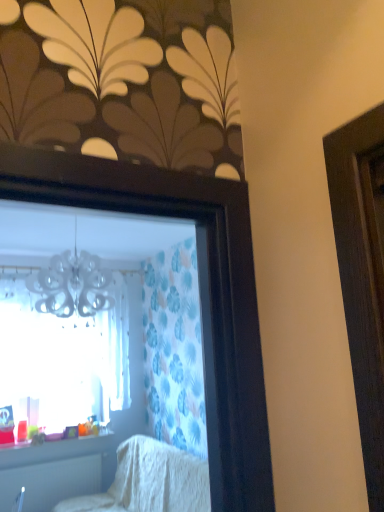
Question: From the image's perspective, is white plastic radiator at lower left located beneath white textured blanket at lower center?

Choices:
 (A) no
 (B) yes

Answer: (B)

Question: From the image's perspective, does white plastic radiator at lower left appear higher than white textured blanket at lower center?

Choices:
 (A) no
 (B) yes

Answer: (A)

Question: Is white plastic radiator at lower left turned away from white textured blanket at lower center?

Choices:
 (A) yes
 (B) no

Answer: (B)

Question: Is the depth of white plastic radiator at lower left greater than that of white textured blanket at lower center?

Choices:
 (A) yes
 (B) no

Answer: (A)

Question: Is white plastic radiator at lower left placed right next to white textured blanket at lower center?

Choices:
 (A) no
 (B) yes

Answer: (A)

Question: Do you think translucent plastic cups at lower left is within white textured blanket at lower center, or outside of it?

Choices:
 (A) outside
 (B) inside

Answer: (A)

Question: In terms of size, does translucent plastic cups at lower left appear bigger or smaller than white textured blanket at lower center?

Choices:
 (A) big
 (B) small

Answer: (B)

Question: Looking at their shapes, would you say translucent plastic cups at lower left is wider or thinner than white textured blanket at lower center?

Choices:
 (A) wide
 (B) thin

Answer: (B)

Question: Considering the relative positions of translucent plastic cups at lower left and white textured blanket at lower center in the image provided, is translucent plastic cups at lower left to the left or to the right of white textured blanket at lower center?

Choices:
 (A) right
 (B) left

Answer: (B)

Question: Is white plastic radiator at lower left taller or shorter than transparent glass window at upper left?

Choices:
 (A) short
 (B) tall

Answer: (A)

Question: In terms of size, does white plastic radiator at lower left appear bigger or smaller than transparent glass window at upper left?

Choices:
 (A) small
 (B) big

Answer: (A)

Question: Is white plastic radiator at lower left spatially inside transparent glass window at upper left, or outside of it?

Choices:
 (A) inside
 (B) outside

Answer: (B)

Question: From the image's perspective, is white plastic radiator at lower left above or below transparent glass window at upper left?

Choices:
 (A) below
 (B) above

Answer: (A)

Question: Is point (6, 451) positioned closer to the camera than point (64, 485)?

Choices:
 (A) closer
 (B) farther

Answer: (A)

Question: Relative to white plastic radiator at lower left, is translucent plastic cups at lower left in front or behind?

Choices:
 (A) front
 (B) behind

Answer: (B)